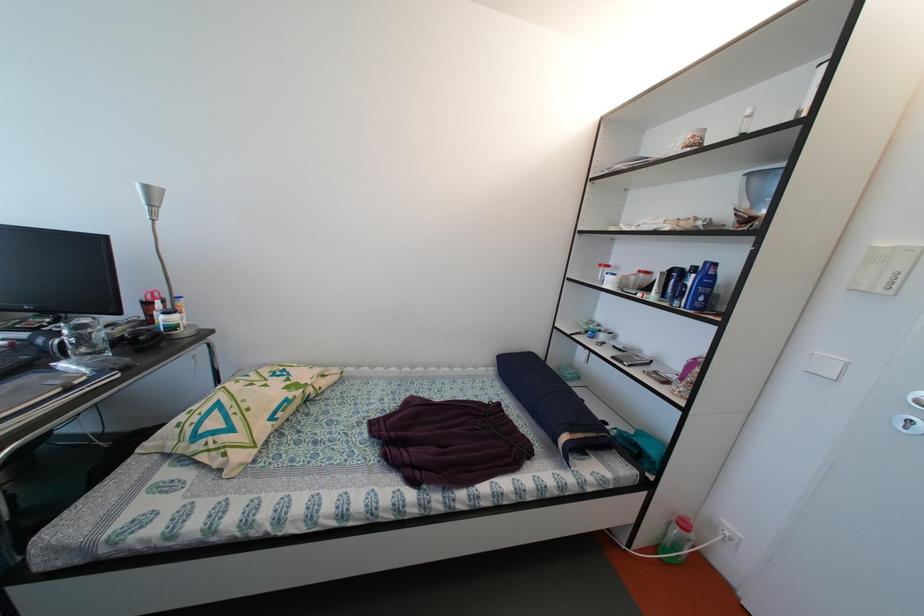
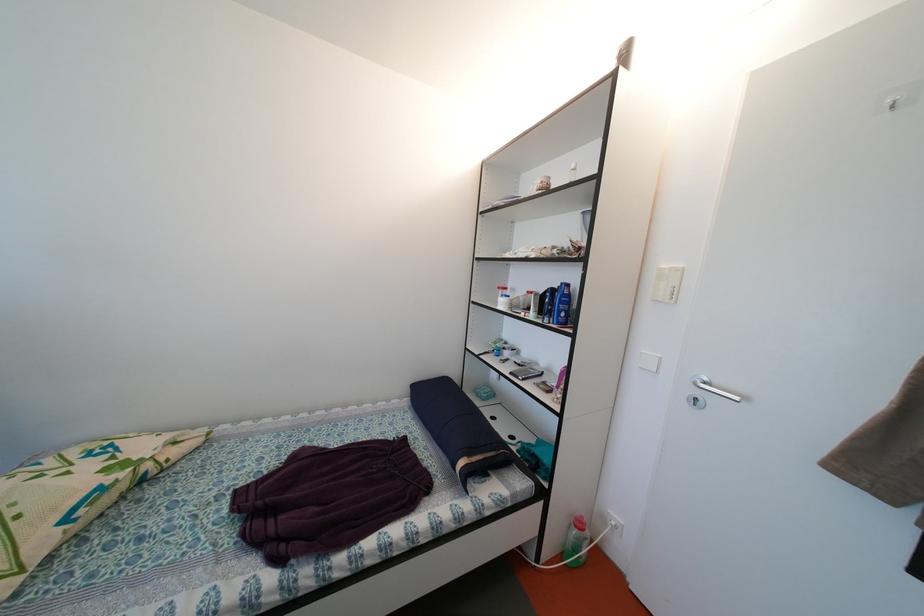
The point at (803, 391) is marked in the first image. Where is the corresponding point in the second image?

(642, 385)